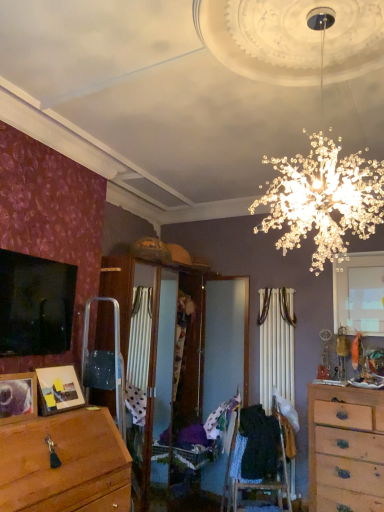
Question: From the image's perspective, relative to patterned fabric at center, which is counted as the first clothing, starting from the left, is wooden photo frame at lower left above or below?

Choices:
 (A) below
 (B) above

Answer: (B)

Question: Would you say wooden photo frame at lower left is inside or outside patterned fabric at center, which is counted as the first clothing, starting from the left?

Choices:
 (A) inside
 (B) outside

Answer: (B)

Question: Estimate the real-world distances between objects in this image. Which object is closer to the wooden photo frame at lower left?

Choices:
 (A) black fabric at center, which is the second clothing from left to right
 (B) patterned fabric at center, acting as the second clothing starting from the right
 (C) wooden chest of drawers at right
 (D) white matte window at upper right

Answer: (B)

Question: Which is farther from the white matte window at upper right?

Choices:
 (A) patterned fabric at center, which is counted as the first clothing, starting from the left
 (B) wooden chest of drawers at right
 (C) black fabric at center, which is the second clothing from left to right
 (D) wooden photo frame at lower left

Answer: (D)